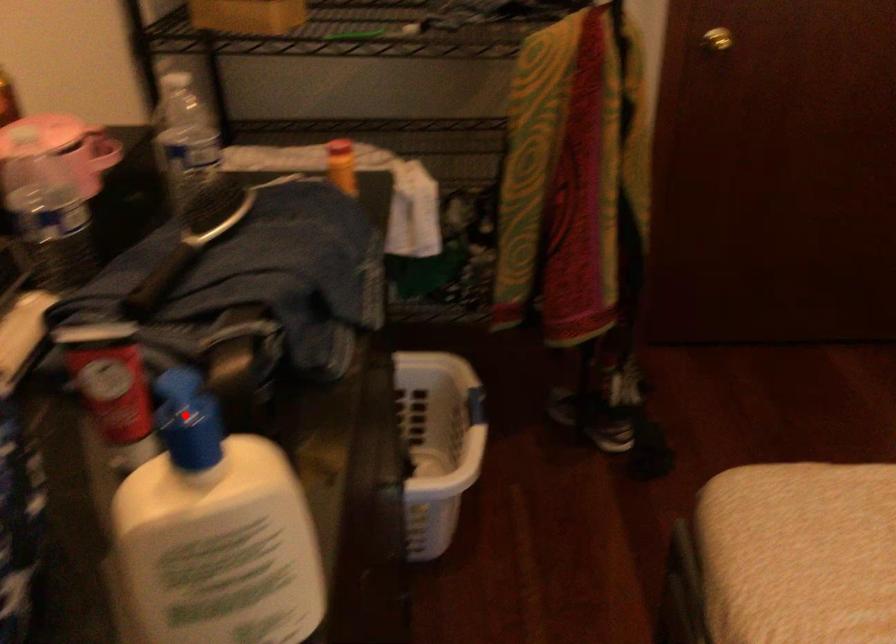
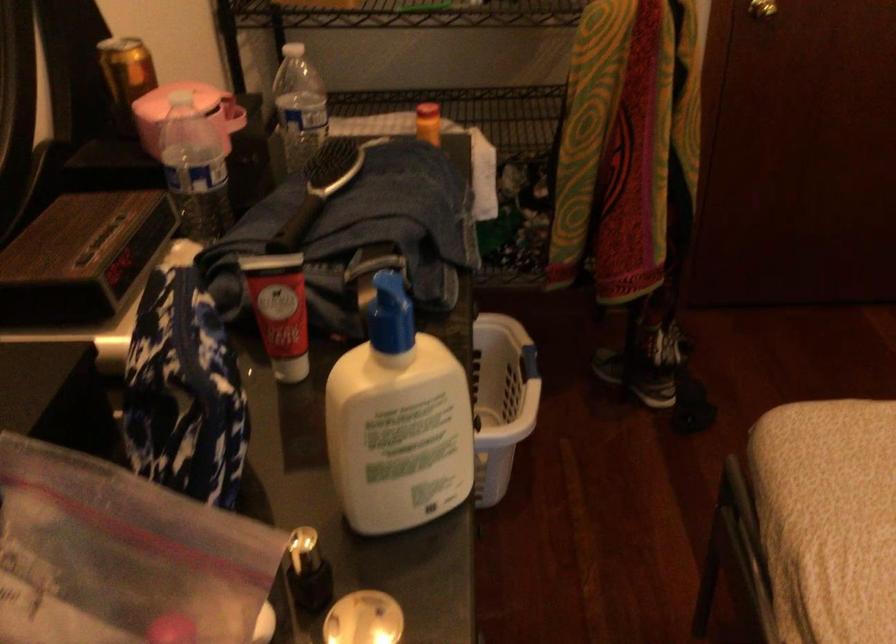
Question: I am providing you with two images of the same scene from different viewpoints. In image1, a red point is highlighted. Considering the same 3D point in image2, which of the following is correct?

Choices:
 (A) It is closer
 (B) It is farther

Answer: (B)